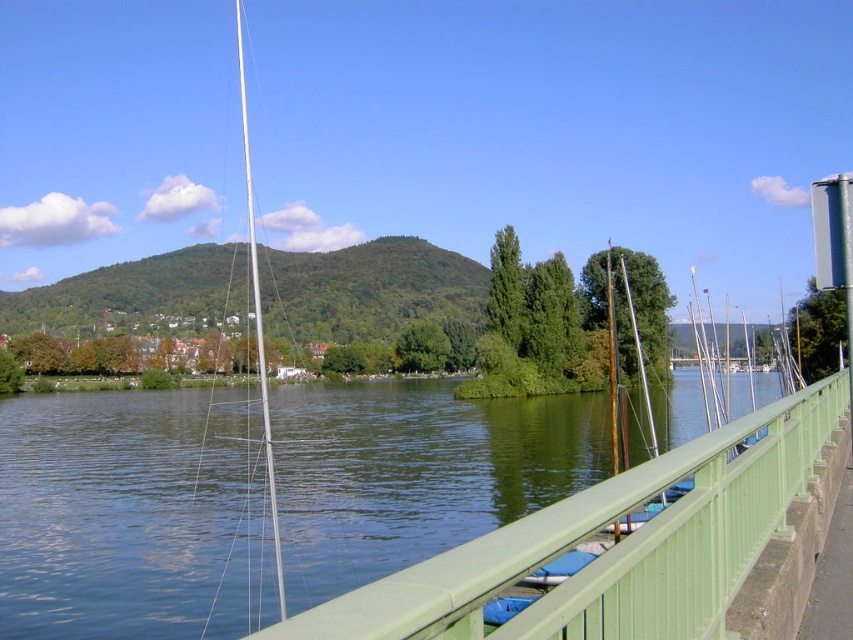
Between green painted metal railing at center and silver/metallic mast at center-left, which one has more height?

With more height is silver/metallic mast at center-left.

Between point (555, 616) and point (276, 552), which one is positioned in front?

Point (555, 616)

Where is `green painted metal railing at center`? green painted metal railing at center is located at coordinates (614, 545).